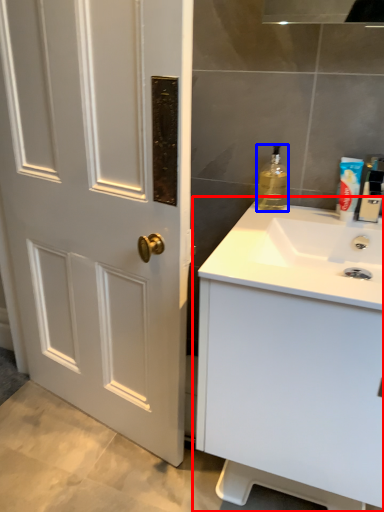
Question: Which object is closer to the camera taking this photo, bathroom cabinet (highlighted by a red box) or bottle (highlighted by a blue box)?

Choices:
 (A) bathroom cabinet
 (B) bottle

Answer: (A)